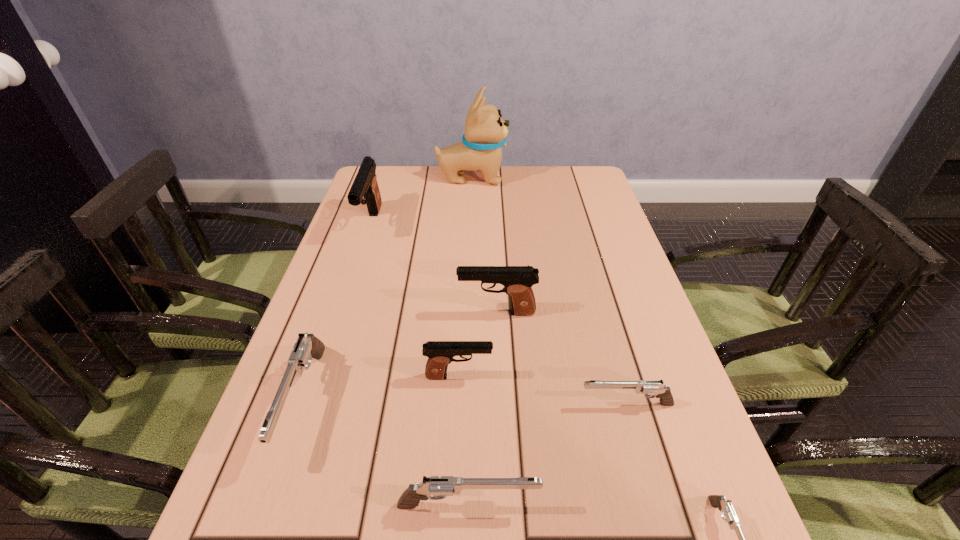
You are a GUI agent. You are given a task and a screenshot of the screen. Output one action in this format:
    pyautogui.click(x=<x>, y=<y>)
    Task: Click on the vacant area that lies between the biggest silver pistol and the sixth tallest pistol
    The height and width of the screenshot is (540, 960).
    Given the screenshot: What is the action you would take?
    pyautogui.click(x=465, y=402)

Locate an element on the screen. empty space that is in between the sixth tallest pistol and the second smallest black pistol is located at coordinates (562, 359).

Identify the location of free spot between the third farthest object and the biggest silver pistol. (400, 357).

This screenshot has height=540, width=960. Identify the location of vacant space in between the sixth tallest object and the biggest black pistol. (420, 364).

Locate an element on the screen. object that ranks as the seventh closest to the sixth shortest pistol is located at coordinates (485, 132).

The height and width of the screenshot is (540, 960). In order to click on object that is the sixth closest one to the shortest pistol in this screenshot , I will do (x=365, y=190).

Identify the location of pistol that stands as the third closest to the shortest pistol. Image resolution: width=960 pixels, height=540 pixels. (440, 353).

Identify the location of pistol that stands as the second closest to the shortest pistol. (435, 487).

What are the coordinates of `black pistol that is the nearest to the nearest black pistol` in the screenshot? It's located at (517, 280).

Identify the location of the second closest black pistol to the second farthest black pistol. (365, 190).